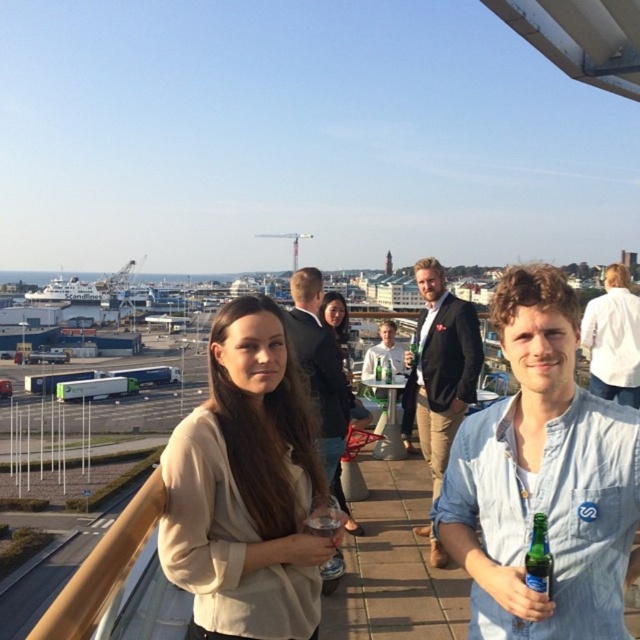
You are an event planner organizing a photoshoot on this rooftop. You need to place a backdrop between the light brown leather jacket at center and the white cotton shirt at upper right. Since the backdrop is 1.2 meters wide, will it fit between them?

The light brown leather jacket at center is narrower than the white cotton shirt at upper right. However, the exact distance between them isn not provided in the description. The objects description only compares their widths, not the space between them. Therefore, it is impossible to determine if the backdrop will fit based on the given information.

You are a photographer trying to capture both the light brown leather jacket at center and the white cotton shirt at upper right in the same frame. Which one should you focus on first to ensure they both fit in the shot?

The light brown leather jacket at center is much taller than the white cotton shirt at upper right, so you should focus on the light brown leather jacket at center first to ensure both fit in the shot.